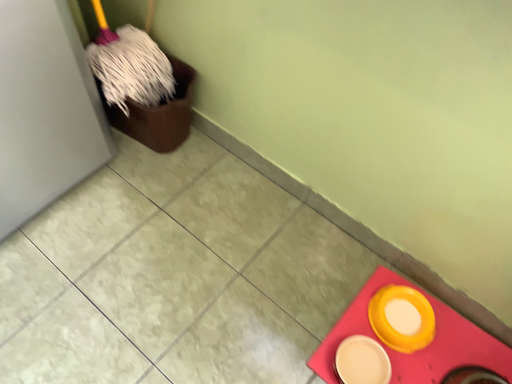
Question: From the image's perspective, is matte yellow plate at lower right, marked as the 1th tableware in a left-to-right arrangement, above or below matte yellow bowl at lower right?

Choices:
 (A) above
 (B) below

Answer: (A)

Question: In terms of width, does matte yellow plate at lower right, which ranks as the 2th tableware in right-to-left order, look wider or thinner when compared to matte yellow bowl at lower right?

Choices:
 (A) wide
 (B) thin

Answer: (B)

Question: Estimate the real-world distances between objects in this image. Which object is farther from the matte yellow bowl at lower right?

Choices:
 (A) matte yellow plate at lower right, which ranks as the 2th tableware in right-to-left order
 (B) yellow matte bowl at lower right, the 2th tableware from the left

Answer: (A)

Question: Which object is the farthest from the matte yellow bowl at lower right?

Choices:
 (A) matte yellow plate at lower right, marked as the 1th tableware in a left-to-right arrangement
 (B) yellow matte bowl at lower right, the first tableware in the right-to-left sequence

Answer: (A)